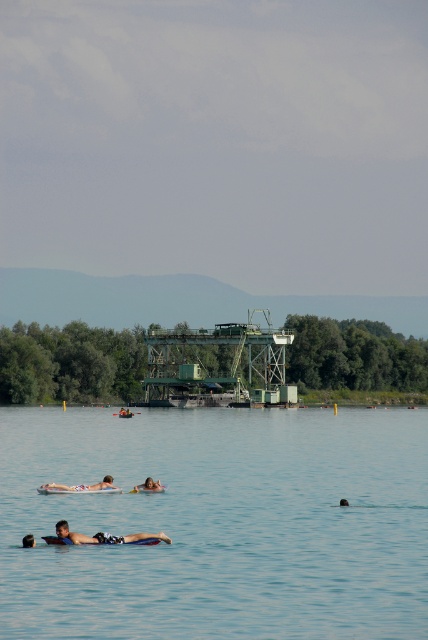
You are a photographer trying to capture a shot of the smooth tan skin at center and the smooth skin person at lower center. Based on their positions, which one is positioned to the right side of the other?

The smooth tan skin at center is positioned to the right of the smooth skin person at lower center.

Consider the image. You are a photographer trying to capture the smooth skin person at lower center without the matte black swim trunks at center appearing in the foreground. Is this possible based on their positions?

The matte black swim trunks at center is positioned over the smooth skin person at lower center, so it would block the view of the person entirely. You cannot capture the person without the swim trunks in the foreground.